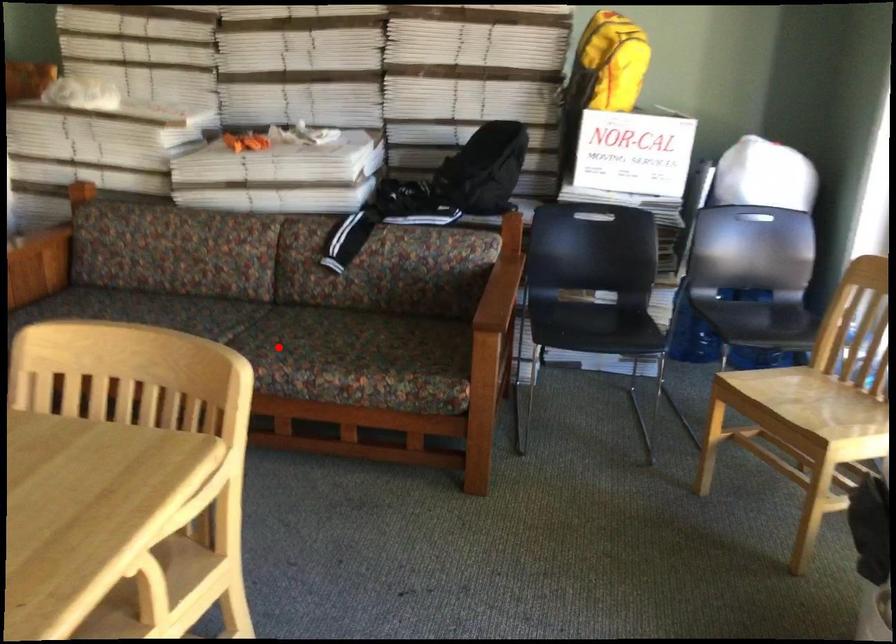
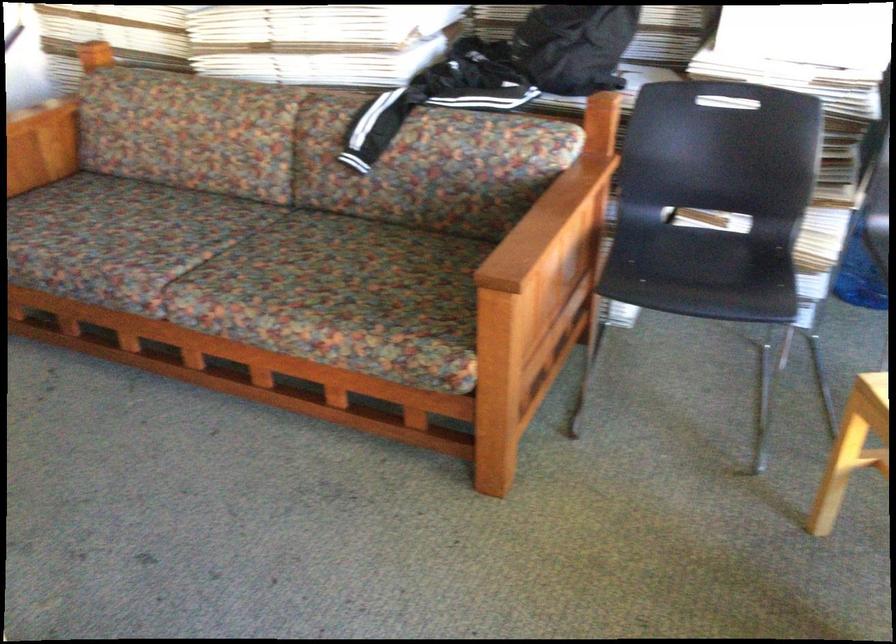
Find the pixel in the second image that matches the highlighted location in the first image.

(256, 275)